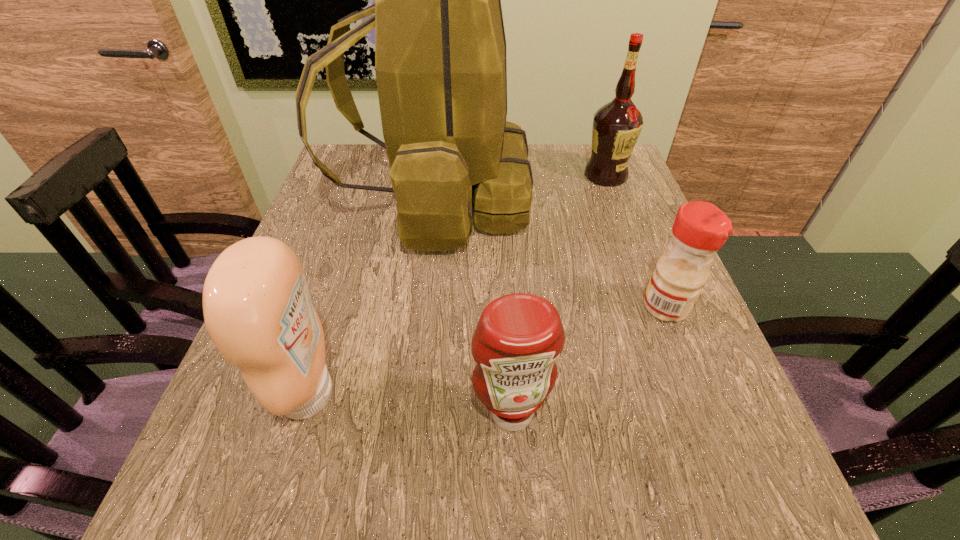
Where is `the tallest object`? The width and height of the screenshot is (960, 540). the tallest object is located at coordinates tap(440, 49).

Locate an element on the screen. Image resolution: width=960 pixels, height=540 pixels. the fourth shortest object is located at coordinates (617, 125).

This screenshot has height=540, width=960. Find the location of `the tallest condiment`. the tallest condiment is located at coordinates (257, 309).

The image size is (960, 540). What are the coordinates of `the third tallest object` in the screenshot? It's located at (257, 309).

The height and width of the screenshot is (540, 960). What are the coordinates of `the second condiment from right to left` in the screenshot? It's located at (519, 336).

Where is `the farthest condiment`? The image size is (960, 540). the farthest condiment is located at coordinates (700, 229).

This screenshot has height=540, width=960. I want to click on the rightmost condiment, so click(700, 229).

Identify the location of vacant space located on the front-facing side of the backpack. This screenshot has width=960, height=540. (616, 198).

Find the location of `free region located on the label of the fourth shortest object`. free region located on the label of the fourth shortest object is located at coordinates (617, 206).

Where is `vacant region located 0.370m on the label of the leftmost condiment`? Image resolution: width=960 pixels, height=540 pixels. vacant region located 0.370m on the label of the leftmost condiment is located at coordinates (562, 394).